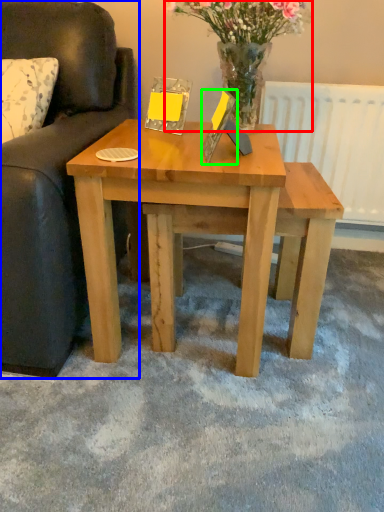
Question: Which object is the closest to the floral arrangement (highlighted by a red box)? Choose among these: studio couch (highlighted by a blue box) or picture frame (highlighted by a green box).

Choices:
 (A) studio couch
 (B) picture frame

Answer: (B)